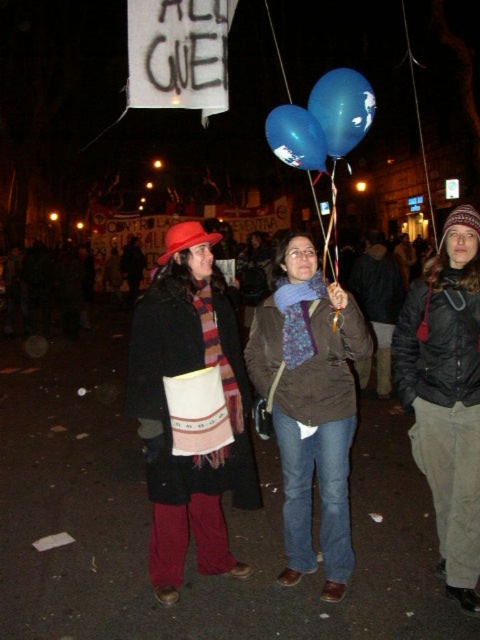
Question: Which of the following is the farthest from the observer?

Choices:
 (A) (314, 124)
 (B) (360, 330)
 (C) (462, 337)

Answer: (B)

Question: Among these points, which one is nearest to the camera?

Choices:
 (A) (454, 337)
 (B) (212, 452)
 (C) (323, 97)

Answer: (C)

Question: Which of the following is the farthest from the observer?

Choices:
 (A) (319, 141)
 (B) (474, 506)
 (C) (316, 90)
 (D) (192, 356)

Answer: (D)

Question: Considering the relative positions of matte brown jacket at center and blue glossy balloon at center in the image provided, where is matte brown jacket at center located with respect to blue glossy balloon at center?

Choices:
 (A) right
 (B) left

Answer: (B)

Question: Is knitted wool scarf at center smaller than matte black jacket at center?

Choices:
 (A) no
 (B) yes

Answer: (A)

Question: Can you confirm if knitted wool scarf at center is positioned to the left of matte brown jacket at center?

Choices:
 (A) yes
 (B) no

Answer: (A)